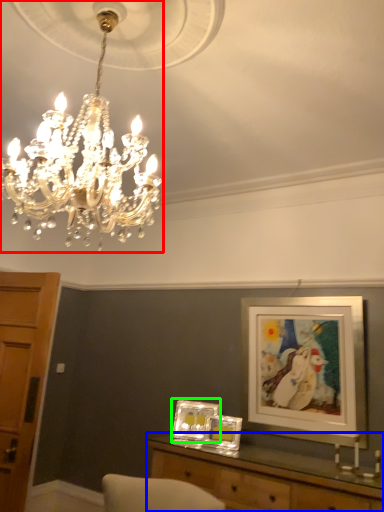
Question: Which object is the farthest from lamp (highlighted by a red box)? Choose among these: table (highlighted by a blue box) or picture frame (highlighted by a green box).

Choices:
 (A) table
 (B) picture frame

Answer: (B)